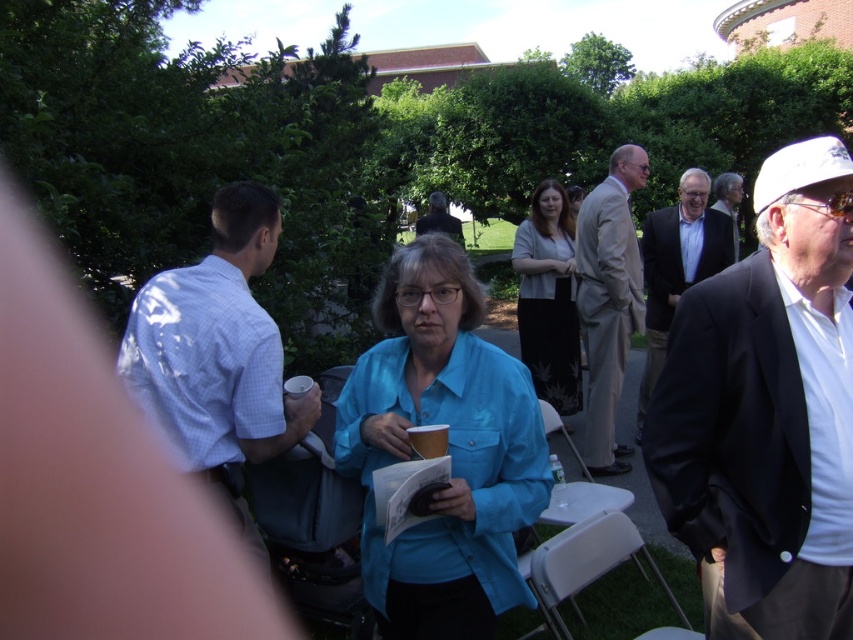
You are at the event and want to take a photo of the point at coordinates (735, 234). The camera has a focal length of 50mm and a sensor size of 24mm. What is the minimum distance you need to be from the point to ensure the entire point fits in the frame?

The point at coordinates (735, 234) is 6.31 meters from the camera. To ensure the entire point fits in the frame with a 50mm focal length and 24mm sensor, you need to be at least 6.31 meters away.

You are at an outdoor event and need to locate the light brown suit at center and the white paper cup at center. Which object is taller?

The light brown suit at center is much taller than the white paper cup at center.

You are at the outdoor gathering and want to move from the point at coordinates point (x=123, y=346) to the point at coordinates point (x=413, y=435). Is the destination point in front of or behind your current position?

The point at coordinates point (x=123, y=346) is behind the point at coordinates point (x=413, y=435), so the destination point is in front of your current position.